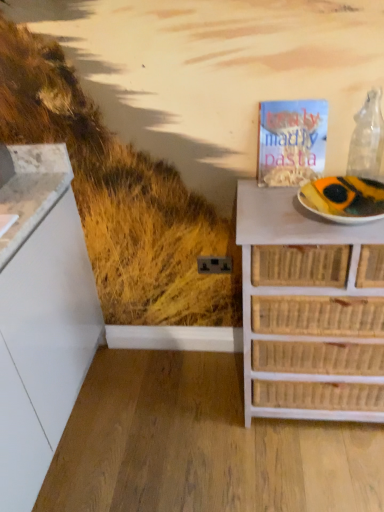
Question: From the image's perspective, is transparent glass wine bottle at upper right above white paper plate at right?

Choices:
 (A) yes
 (B) no

Answer: (A)

Question: Considering the relative sizes of transparent glass wine bottle at upper right and white paper plate at right in the image provided, is transparent glass wine bottle at upper right thinner than white paper plate at right?

Choices:
 (A) yes
 (B) no

Answer: (A)

Question: Is transparent glass wine bottle at upper right with white paper plate at right?

Choices:
 (A) yes
 (B) no

Answer: (B)

Question: Is transparent glass wine bottle at upper right to the left of white paper plate at right from the viewer's perspective?

Choices:
 (A) yes
 (B) no

Answer: (B)

Question: Are transparent glass wine bottle at upper right and white paper plate at right located far from each other?

Choices:
 (A) no
 (B) yes

Answer: (A)

Question: Can you confirm if transparent glass wine bottle at upper right is bigger than white paper plate at right?

Choices:
 (A) yes
 (B) no

Answer: (B)

Question: Is transparent glass wine bottle at upper right closer to camera compared to matte paper magazine at upper right?

Choices:
 (A) yes
 (B) no

Answer: (A)

Question: Is transparent glass wine bottle at upper right further to the viewer compared to matte paper magazine at upper right?

Choices:
 (A) yes
 (B) no

Answer: (B)

Question: Is transparent glass wine bottle at upper right oriented away from matte paper magazine at upper right?

Choices:
 (A) yes
 (B) no

Answer: (B)

Question: Is transparent glass wine bottle at upper right at the left side of matte paper magazine at upper right?

Choices:
 (A) yes
 (B) no

Answer: (B)

Question: Does transparent glass wine bottle at upper right have a lesser height compared to matte paper magazine at upper right?

Choices:
 (A) yes
 (B) no

Answer: (B)

Question: Considering the relative sizes of transparent glass wine bottle at upper right and matte paper magazine at upper right in the image provided, is transparent glass wine bottle at upper right taller than matte paper magazine at upper right?

Choices:
 (A) no
 (B) yes

Answer: (B)

Question: Are white paper plate at right and transparent glass wine bottle at upper right far apart?

Choices:
 (A) yes
 (B) no

Answer: (B)